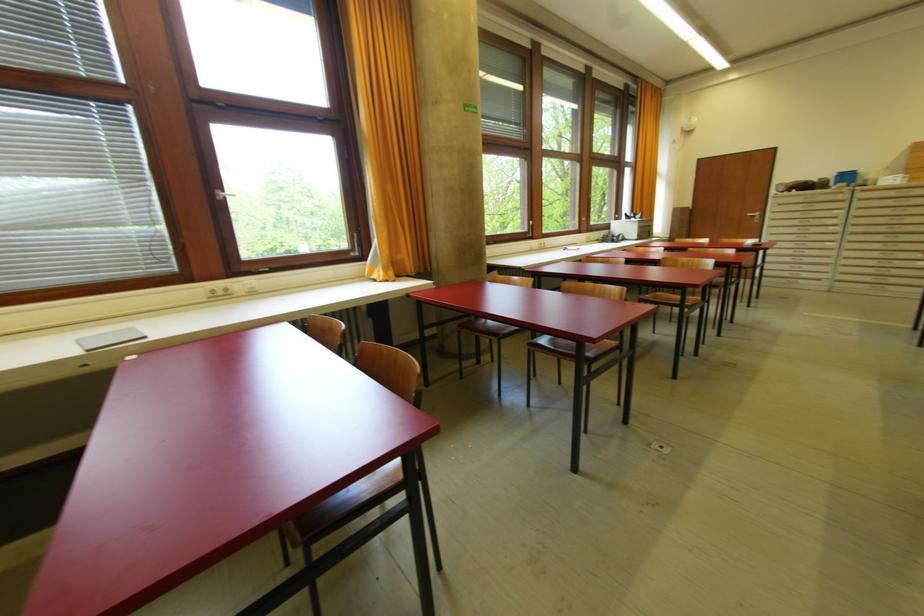
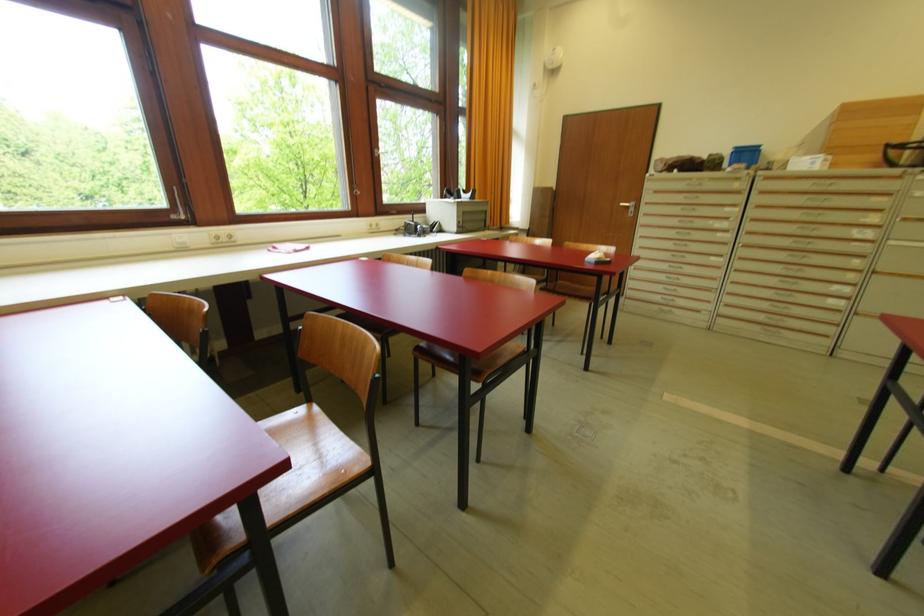
Where in the second image is the point corresponding to [756,217] from the first image?

(629, 209)